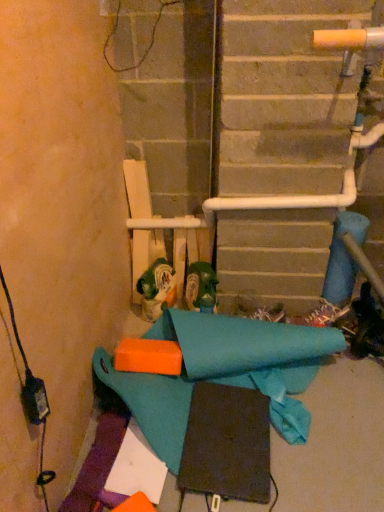
The height and width of the screenshot is (512, 384). Identify the location of green plastic beer can at center. (157, 289).

This screenshot has width=384, height=512. Describe the element at coordinates (157, 289) in the screenshot. I see `green plastic beer can at center` at that location.

Describe the element at coordinates (201, 287) in the screenshot. I see `green matte boot at center` at that location.

What are the coordinates of `green matte boot at center` in the screenshot? It's located at (201, 287).

Find the location of a particular element. green plastic beer can at center is located at coordinates click(x=157, y=289).

Consider the image. Considering the positions of objects green plastic beer can at center and green matte boot at center in the image provided, who is more to the left, green plastic beer can at center or green matte boot at center?

green plastic beer can at center is more to the left.

Considering the positions of objects green plastic beer can at center and green matte boot at center in the image provided, who is behind, green plastic beer can at center or green matte boot at center?

green plastic beer can at center is behind.

Which point is more forward, (x=161, y=269) or (x=212, y=298)?

Point (x=212, y=298)

From the image's perspective, is green plastic beer can at center positioned above or below green matte boot at center?

Clearly, from the image's perspective, green plastic beer can at center is above green matte boot at center.

From a real-world perspective, does green plastic beer can at center sit lower than green matte boot at center?

Yes, from a real-world perspective, green plastic beer can at center is below green matte boot at center.

Is green plastic beer can at center thinner than green matte boot at center?

No.

Considering the relative sizes of green plastic beer can at center and green matte boot at center in the image provided, is green plastic beer can at center shorter than green matte boot at center?

In fact, green plastic beer can at center may be taller than green matte boot at center.

Who is bigger, green plastic beer can at center or green matte boot at center?

green plastic beer can at center is bigger.

Choose the correct answer: Is green plastic beer can at center inside green matte boot at center or outside it?

green plastic beer can at center is not enclosed by green matte boot at center.

Are green plastic beer can at center and green matte boot at center located far from each other?

No, there isn't a large distance between green plastic beer can at center and green matte boot at center.

Based on the photo, could you tell me if green plastic beer can at center is turned towards green matte boot at center?

No, green plastic beer can at center is not oriented towards green matte boot at center.

Locate an element on the screen. The image size is (384, 512). footwear below the green plastic beer can at center (from the image's perspective) is located at coordinates click(x=201, y=287).

Between green matte boot at center and green plastic beer can at center, which one appears on the left side from the viewer's perspective?

From the viewer's perspective, green plastic beer can at center appears more on the left side.

Does green matte boot at center come behind green plastic beer can at center?

No, green matte boot at center is in front of green plastic beer can at center.

Does point (198, 293) come behind point (147, 280)?

No, (198, 293) is closer to viewer.

From the image's perspective, between green matte boot at center and green plastic beer can at center, which one is located above?

green plastic beer can at center, from the image's perspective.

From a real-world perspective, is green matte boot at center positioned over green plastic beer can at center based on gravity?

Correct, in the physical world, green matte boot at center is higher than green plastic beer can at center.

Looking at this image, is green matte boot at center thinner than green plastic beer can at center?

Indeed, green matte boot at center has a lesser width compared to green plastic beer can at center.

Considering the relative sizes of green matte boot at center and green plastic beer can at center in the image provided, is green matte boot at center taller than green plastic beer can at center?

Incorrect, the height of green matte boot at center is not larger of that of green plastic beer can at center.

Which of these two, green matte boot at center or green plastic beer can at center, is bigger?

green plastic beer can at center is bigger.

Which is correct: green matte boot at center is inside green plastic beer can at center, or outside of it?

green matte boot at center is not inside green plastic beer can at center, it's outside.

Are green matte boot at center and green plastic beer can at center beside each other?

green matte boot at center and green plastic beer can at center are not in contact.

Is green matte boot at center facing away from green plastic beer can at center?

No.

How much distance is there between green matte boot at center and green plastic beer can at center?

6.40 inches.

Find the location of a particular element. The height and width of the screenshot is (512, 384). footwear located on the right of green plastic beer can at center is located at coordinates (201, 287).

Identify the location of footwear in front of the green plastic beer can at center. (201, 287).

At what (x,y) coordinates should I click in order to perform the action: click on footwear located on the right of green plastic beer can at center. Please return your answer as a coordinate pair (x, y). The image size is (384, 512). Looking at the image, I should click on click(x=201, y=287).